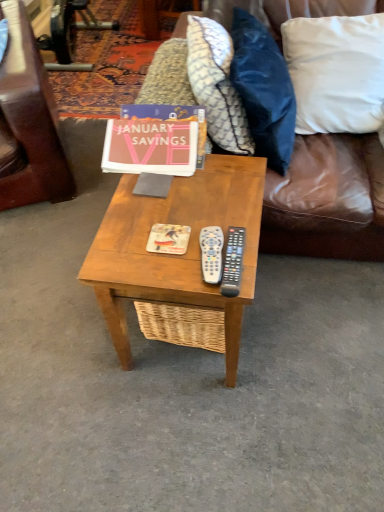
This screenshot has width=384, height=512. I want to click on vacant space situated on the left part of white plastic remote at center, marked as the second remote in a right-to-left arrangement, so click(x=159, y=251).